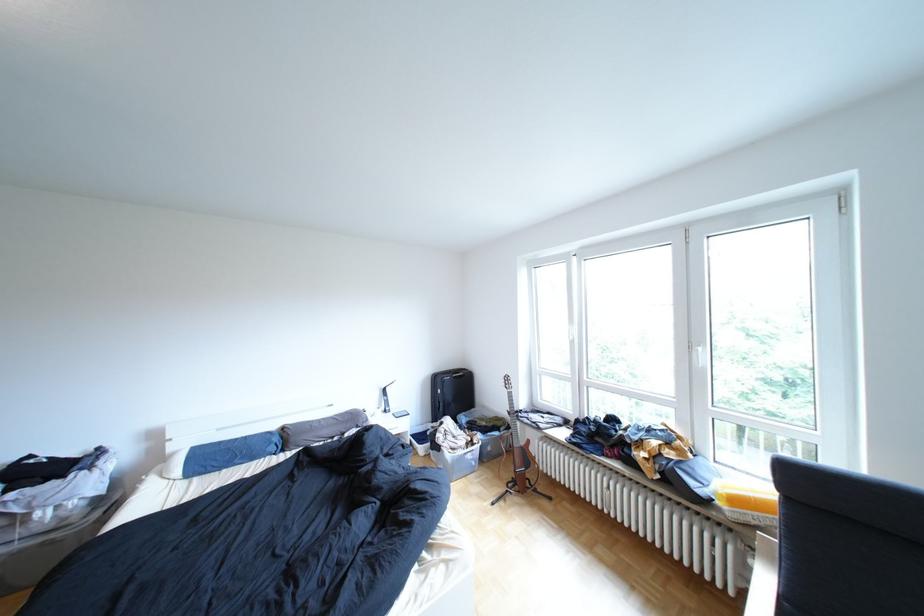
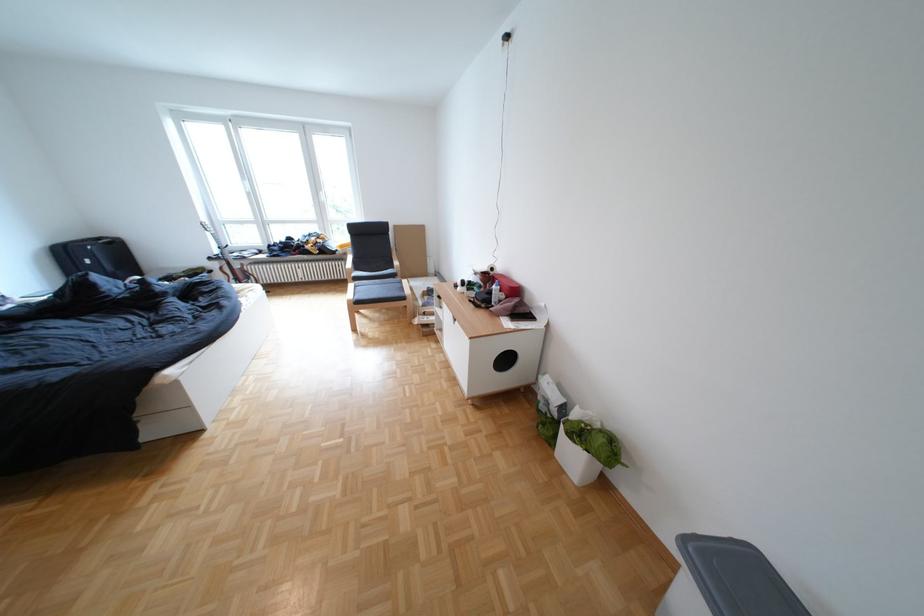
Where in the second image is the point corresponding to point (526, 415) from the first image?

(225, 259)